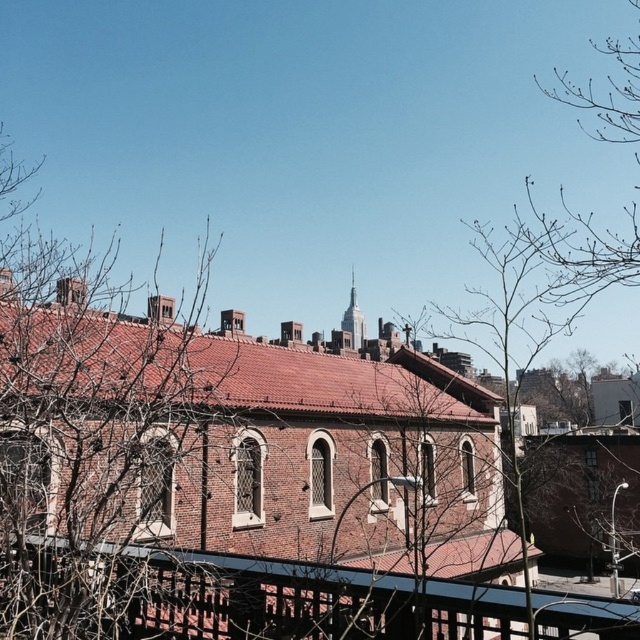
Who is taller, bare branches at left or smooth glass spire at upper center?

bare branches at left is taller.

Who is more distant from viewer, [134,419] or [344,316]?

The point [344,316] is behind.

The image size is (640, 640). I want to click on bare branches at left, so click(x=90, y=435).

Identify the location of bare branches at left. (90, 435).

Does point (154, 609) come behind point (352, 296)?

No, (154, 609) is closer to viewer.

Does brown wooden rail at center have a lesser height compared to smooth glass spire at upper center?

Indeed, brown wooden rail at center has a lesser height compared to smooth glass spire at upper center.

Is point (305, 576) less distant than point (344, 324)?

Yes, it is.

I want to click on brown wooden rail at center, so click(308, 600).

In the scene shown: Who is shorter, bare branches at left or brown wooden rail at center?

brown wooden rail at center is shorter.

Who is more distant from viewer, (97, 372) or (40, 540)?

Point (97, 372)

In order to click on bare branches at left in this screenshot , I will do `click(90, 435)`.

In order to click on bare branches at left in this screenshot , I will do `click(90, 435)`.